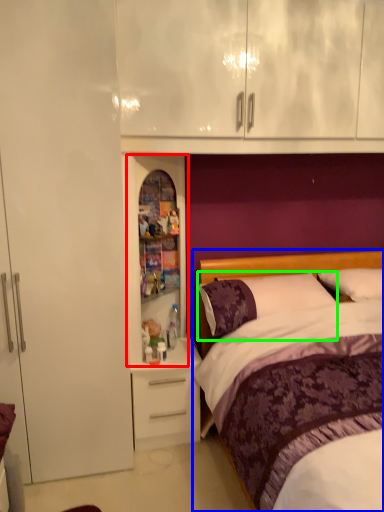
Question: Estimate the real-world distances between objects in this image. Which object is farther from medicine cabinet (highlighted by a red box), bed (highlighted by a blue box) or pillow (highlighted by a green box)?

Choices:
 (A) bed
 (B) pillow

Answer: (A)